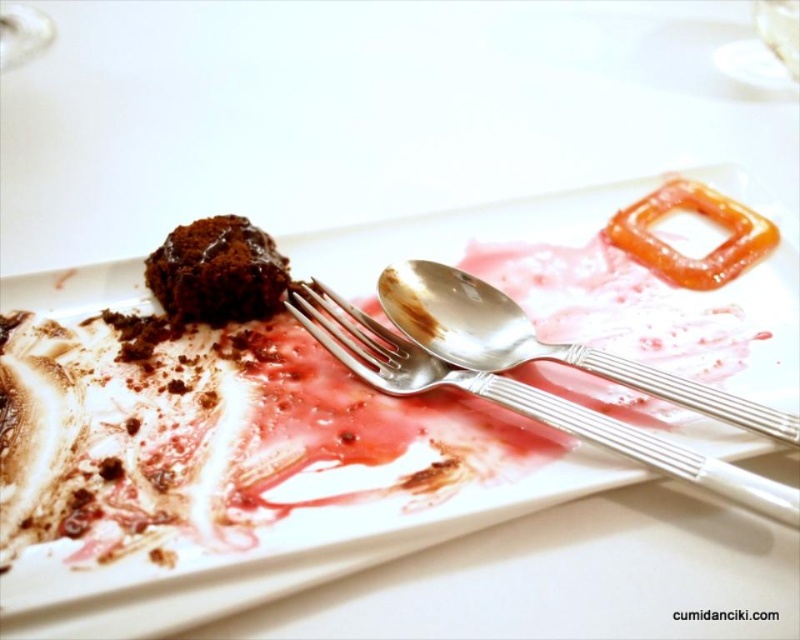
Between chocolate matte cake at upper left and translucent orange pretzel at upper right, which one has less height?

Standing shorter between the two is chocolate matte cake at upper left.

From the picture: Is chocolate matte cake at upper left positioned behind translucent orange pretzel at upper right?

No, it is in front of translucent orange pretzel at upper right.

Is point (190, 280) closer to camera compared to point (738, 269)?

Yes, point (190, 280) is in front of point (738, 269).

You are a GUI agent. You are given a task and a screenshot of the screen. Output one action in this format:
    pyautogui.click(x=<x>, y=<y>)
    Task: Click on the chocolate matte cake at upper left
    The width and height of the screenshot is (800, 640).
    Given the screenshot: What is the action you would take?
    pyautogui.click(x=218, y=272)

Who is shorter, silver polished fork at center or chocolate matte cake at upper left?

chocolate matte cake at upper left

Based on the photo, is silver polished fork at center to the right of chocolate matte cake at upper left from the viewer's perspective?

Yes, silver polished fork at center is to the right of chocolate matte cake at upper left.

Does point (374, 364) come in front of point (208, 316)?

Yes.

Find the location of a particular element. silver polished fork at center is located at coordinates (518, 401).

Who is positioned more to the left, white glossy plate at center or translucent orange pretzel at upper right?

Positioned to the left is white glossy plate at center.

Is white glossy plate at center bigger than translucent orange pretzel at upper right?

Indeed, white glossy plate at center has a larger size compared to translucent orange pretzel at upper right.

Measure the distance between point (206, 588) and camera.

A distance of 3.38 feet exists between point (206, 588) and camera.

You are a GUI agent. You are given a task and a screenshot of the screen. Output one action in this format:
    pyautogui.click(x=<x>, y=<y>)
    Task: Click on the white glossy plate at center
    The image size is (800, 640).
    Given the screenshot: What is the action you would take?
    (x=236, y=467)